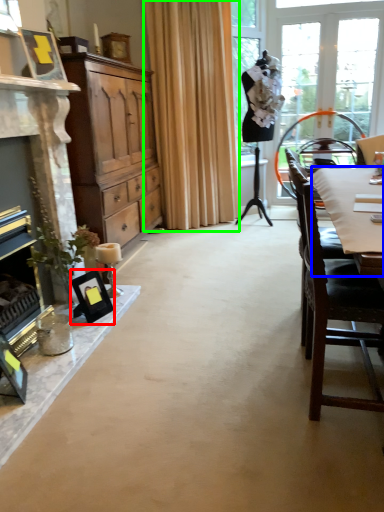
Question: Which object is positioned farthest from picture frame (highlighted by a red box)? Select from desk (highlighted by a blue box) and curtain (highlighted by a green box).

Choices:
 (A) desk
 (B) curtain

Answer: (B)